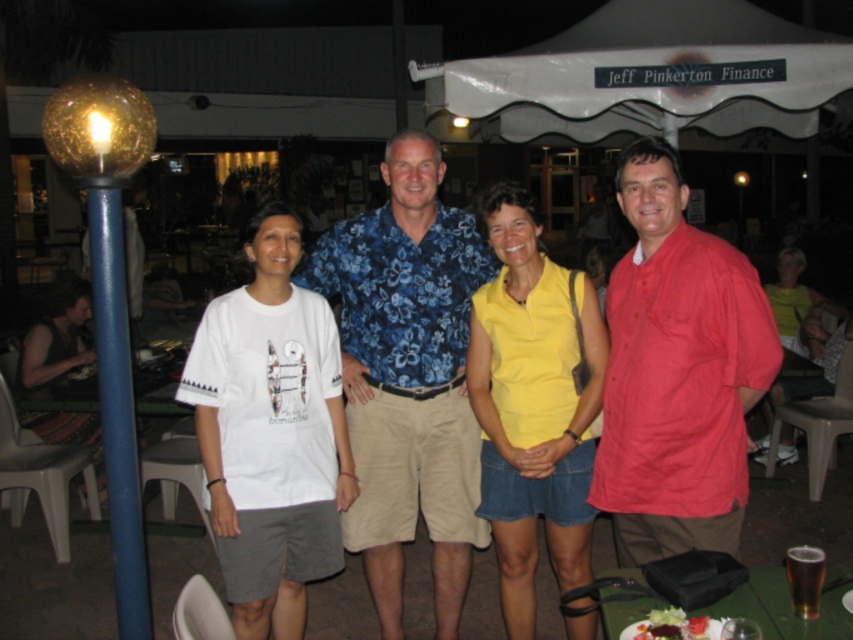
Can you confirm if red cotton shirt at right is positioned to the right of white fabric canopy at upper center?

In fact, red cotton shirt at right is to the left of white fabric canopy at upper center.

Is red cotton shirt at right smaller than white fabric canopy at upper center?

Correct, red cotton shirt at right occupies less space than white fabric canopy at upper center.

Is point (648, 275) farther from camera compared to point (672, 102)?

No, it is in front of (672, 102).

Where is `red cotton shirt at right`? The height and width of the screenshot is (640, 853). red cotton shirt at right is located at coordinates (677, 372).

Is point (711, 540) positioned behind point (477, 328)?

That is False.

Is point (634, 451) closer to viewer compared to point (537, 236)?

Yes.

I want to click on red cotton shirt at right, so click(677, 372).

From the picture: Is white matte t-shirt at center below white cotton t-shirt at left?

Indeed, white matte t-shirt at center is positioned under white cotton t-shirt at left.

Is point (325, 323) less distant than point (70, 316)?

That is True.

Find the location of a particular element. This screenshot has height=640, width=853. white matte t-shirt at center is located at coordinates (271, 433).